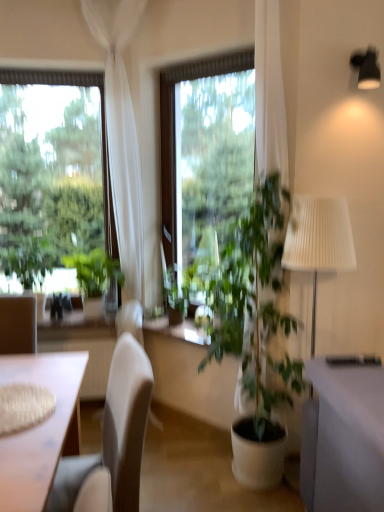
Question: Would you say green leafy plant at left is part of transparent glass window at center, the 1th window in the right-to-left sequence,'s contents?

Choices:
 (A) yes
 (B) no

Answer: (B)

Question: Is transparent glass window at center, the 2th window from the left, smaller than green leafy plant at left?

Choices:
 (A) no
 (B) yes

Answer: (A)

Question: Is transparent glass window at center, the 2th window from the left, to the right of green leafy plant at left from the viewer's perspective?

Choices:
 (A) yes
 (B) no

Answer: (A)

Question: Is transparent glass window at center, the 2th window from the left, further to camera compared to green leafy plant at left?

Choices:
 (A) yes
 (B) no

Answer: (B)

Question: From a real-world perspective, does transparent glass window at center, the 1th window in the right-to-left sequence, stand above green leafy plant at left?

Choices:
 (A) yes
 (B) no

Answer: (A)

Question: Which is correct: white sheer curtain at left is inside green leafy plant at left, or outside of it?

Choices:
 (A) outside
 (B) inside

Answer: (A)

Question: Considering their positions, is white sheer curtain at left located in front of or behind green leafy plant at left?

Choices:
 (A) behind
 (B) front

Answer: (B)

Question: Would you say white sheer curtain at left is to the left or to the right of green leafy plant at left in the picture?

Choices:
 (A) right
 (B) left

Answer: (A)

Question: From a real-world perspective, is white sheer curtain at left above or below green leafy plant at left?

Choices:
 (A) below
 (B) above

Answer: (B)

Question: From a real-world perspective, is transparent glass window at left, the 1th window when ordered from left to right, physically located above or below transparent glass window at center, the 1th window in the right-to-left sequence?

Choices:
 (A) below
 (B) above

Answer: (A)

Question: Visually, is transparent glass window at left, the 1th window when ordered from left to right, positioned to the left or to the right of transparent glass window at center, the 1th window in the right-to-left sequence?

Choices:
 (A) right
 (B) left

Answer: (B)

Question: Considering their positions, is transparent glass window at left, the 1th window when ordered from left to right, located in front of or behind transparent glass window at center, the 1th window in the right-to-left sequence?

Choices:
 (A) front
 (B) behind

Answer: (B)

Question: Looking at their shapes, would you say transparent glass window at left, the 1th window when ordered from left to right, is wider or thinner than transparent glass window at center, the 2th window from the left?

Choices:
 (A) thin
 (B) wide

Answer: (B)

Question: From the image's perspective, is green leafy plant at left, marked as the first houseplant in a left-to-right arrangement, above or below green leafy plant at center, the second houseplant positioned from the left?

Choices:
 (A) above
 (B) below

Answer: (A)

Question: Is green leafy plant at left, placed as the second houseplant when sorted from right to left, situated inside green leafy plant at center, which is counted as the first houseplant, starting from the right, or outside?

Choices:
 (A) outside
 (B) inside

Answer: (A)